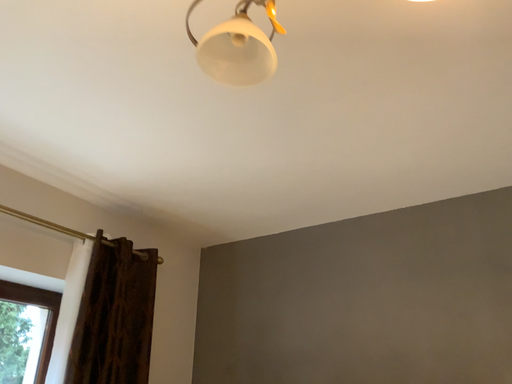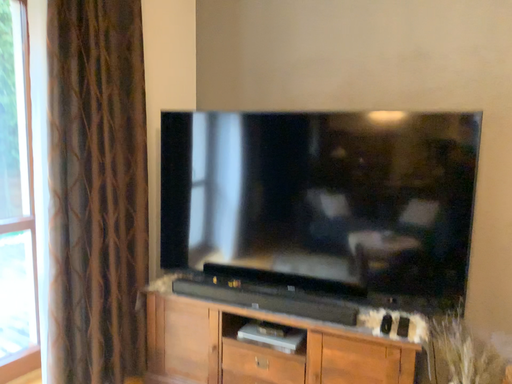
Question: How did the camera likely rotate when shooting the video?

Choices:
 (A) rotated downward
 (B) rotated upward

Answer: (A)